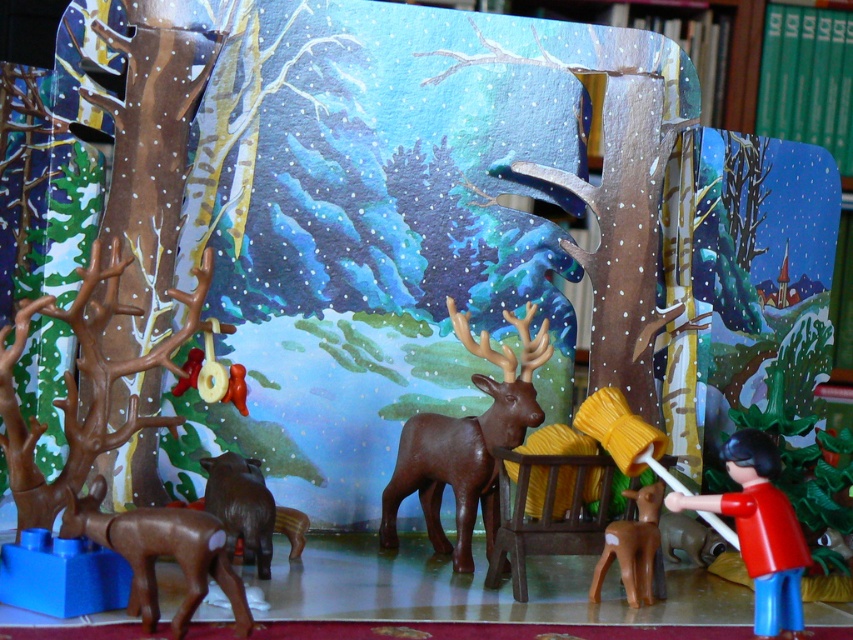
Question: Which point is closer to the camera?

Choices:
 (A) red plastic figure at lower right
 (B) brown matte deer at center
 (C) brown matte deer at lower center

Answer: (A)

Question: Which point appears closest to the camera in this image?

Choices:
 (A) (811, 38)
 (B) (149, 513)
 (C) (646, 541)

Answer: (B)

Question: Can you confirm if green hardcover book at upper right is wider than red plastic figure at lower right?

Choices:
 (A) no
 (B) yes

Answer: (B)

Question: Which of the following is the farthest from the observer?

Choices:
 (A) red plastic figure at lower right
 (B) brown matte deer at center
 (C) brown matte deer at lower center

Answer: (B)

Question: Is brown matte deer at center positioned in front of green hardcover book at upper right?

Choices:
 (A) no
 (B) yes

Answer: (B)

Question: Is brown matte deer at center thinner than green hardcover book at upper right?

Choices:
 (A) no
 (B) yes

Answer: (A)